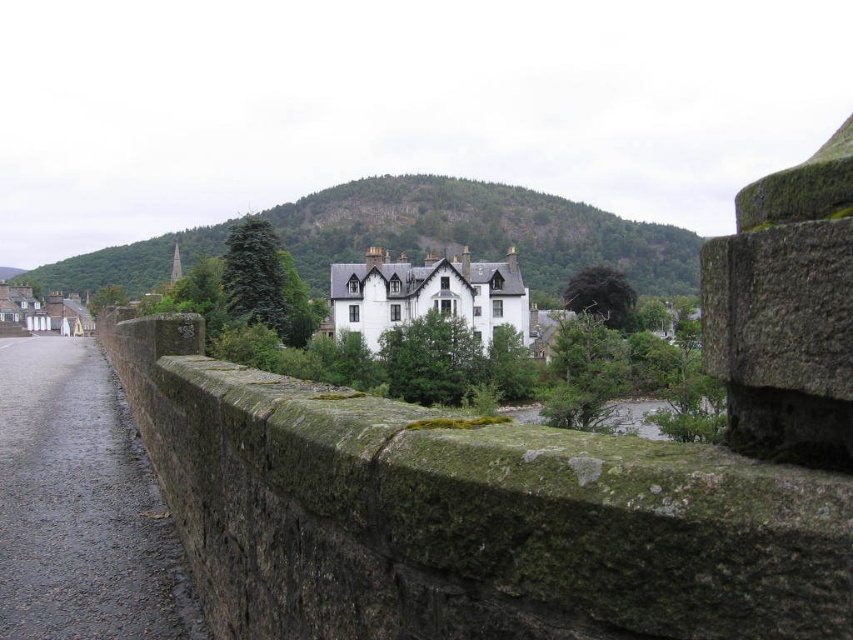
Does green mossy stone ledge at center have a smaller size compared to white painted stone building at center?

Actually, green mossy stone ledge at center might be larger than white painted stone building at center.

Does green mossy stone ledge at center have a greater width compared to white painted stone building at center?

Correct, the width of green mossy stone ledge at center exceeds that of white painted stone building at center.

Who is more forward, (202,502) or (383,264)?

Point (202,502)

Identify the location of green mossy stone ledge at center. (467, 515).